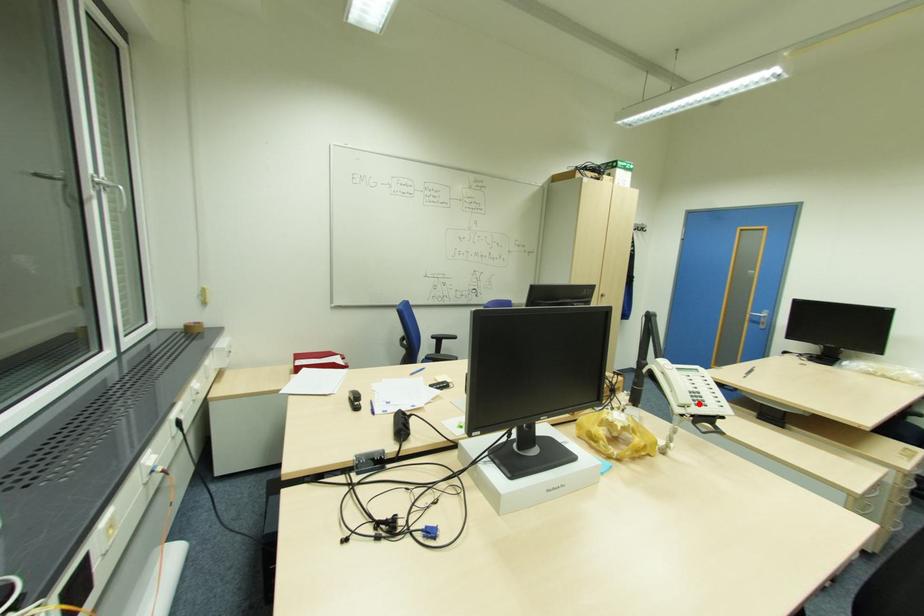
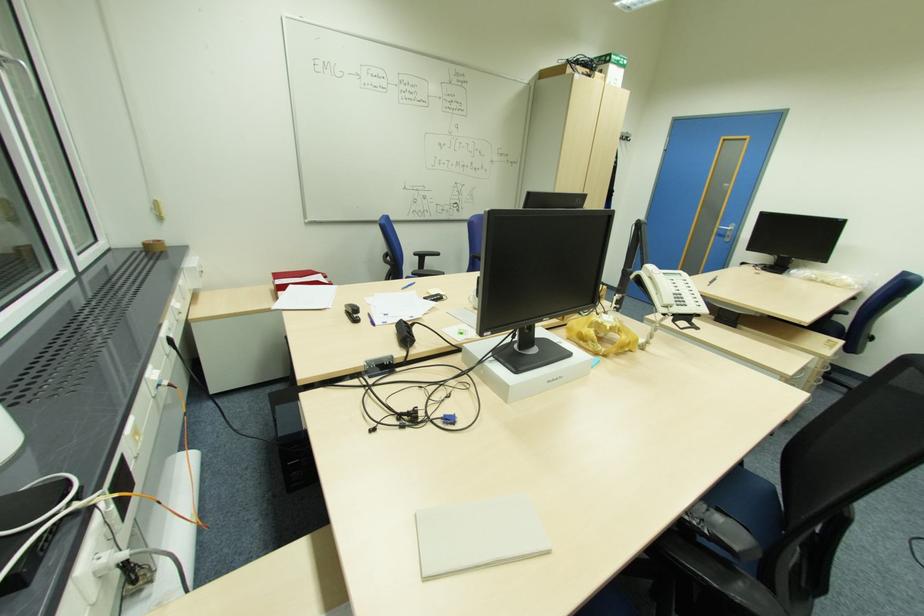
Locate, in the second image, the point that corresponds to the highlighted location in the first image.

(681, 305)